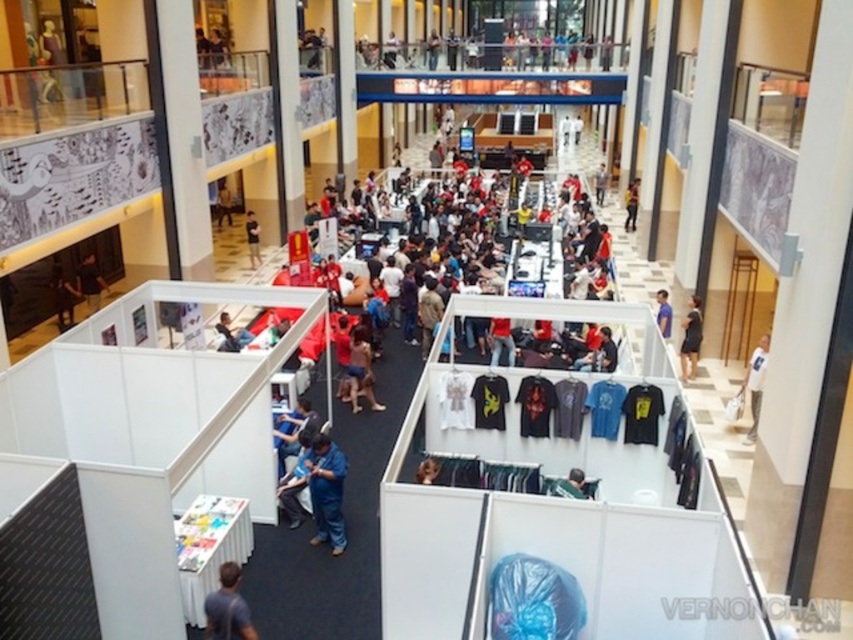
You are an attendee at the event and want to grab the yellow reflective vest at center. However, you first need to pass by the dark blue shirt at lower center. Can you reach the vest without going around the booth?

The dark blue shirt at lower center is closer to the viewer than the yellow reflective vest at center, so you can reach the yellow reflective vest at center by moving past the dark blue shirt at lower center since it is in front of the vest.